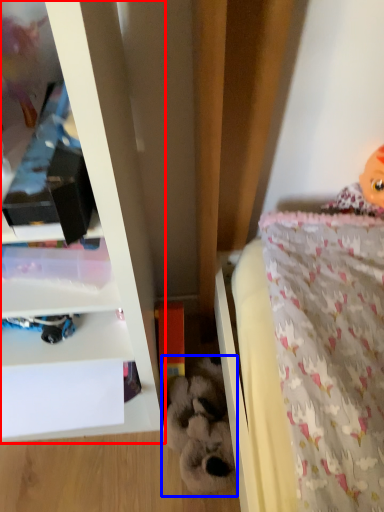
Question: Which point is further to the camera, shelf (highlighted by a red box) or toy (highlighted by a blue box)?

Choices:
 (A) shelf
 (B) toy

Answer: (B)